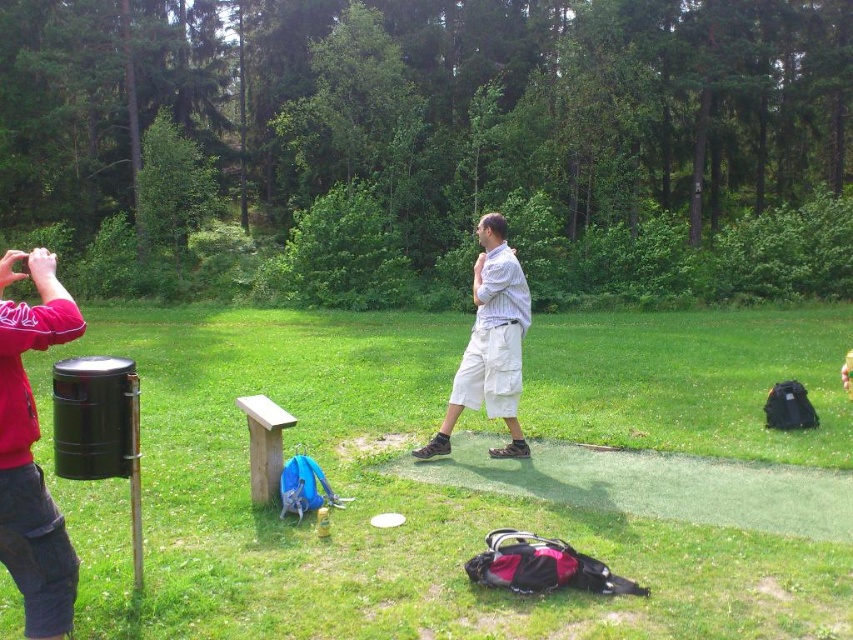
Can you confirm if matte red shirt at left is shorter than white cotton shirt at center?

Correct, matte red shirt at left is not as tall as white cotton shirt at center.

Does matte red shirt at left have a lesser width compared to white cotton shirt at center?

Yes.

What do you see at coordinates (30, 451) in the screenshot?
I see `matte red shirt at left` at bounding box center [30, 451].

Find the location of a particular element. Image resolution: width=853 pixels, height=640 pixels. matte red shirt at left is located at coordinates (30, 451).